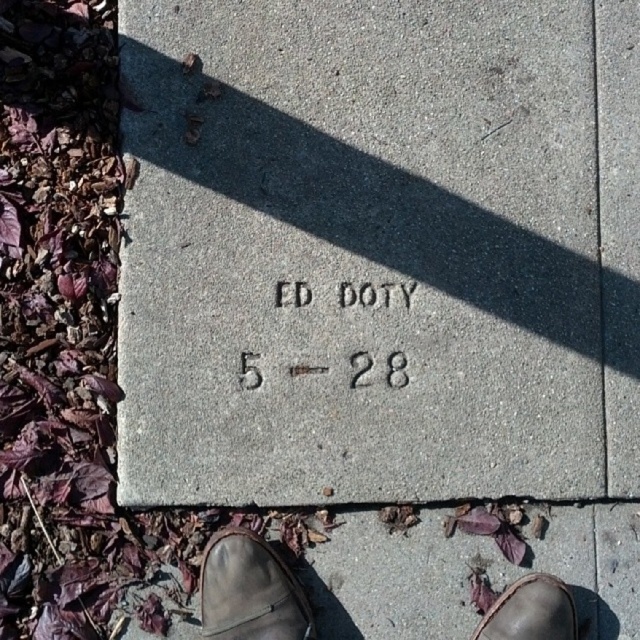
Question: Considering the relative positions of leather boot at lower center and brown leather shoe at lower center in the image provided, where is leather boot at lower center located with respect to brown leather shoe at lower center?

Choices:
 (A) below
 (B) above

Answer: (B)

Question: Which point is closer to the camera?

Choices:
 (A) leather boot at lower center
 (B) black engraved text at center

Answer: (A)

Question: Does leather boot at lower center appear on the right side of black engraved text at center?

Choices:
 (A) no
 (B) yes

Answer: (A)

Question: Does gray concrete marker at center appear on the left side of black engraved text at center?

Choices:
 (A) yes
 (B) no

Answer: (B)

Question: Considering the real-world distances, which object is closest to the gray concrete marker at center?

Choices:
 (A) brown leather shoe at lower center
 (B) black engraved text at center

Answer: (B)

Question: Which object is positioned farthest from the gray concrete marker at center?

Choices:
 (A) brown leather shoe at lower center
 (B) leather boot at lower center

Answer: (A)